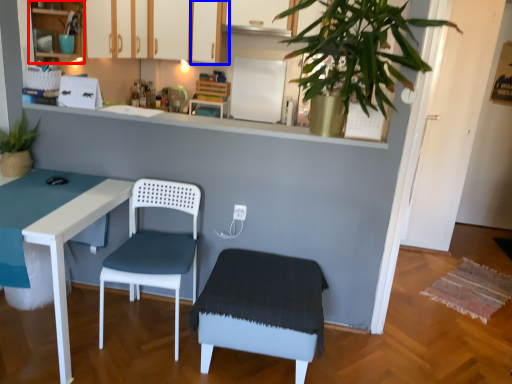
Question: Which point is further to the camera, cabinetry (highlighted by a red box) or cabinetry (highlighted by a blue box)?

Choices:
 (A) cabinetry
 (B) cabinetry

Answer: (B)